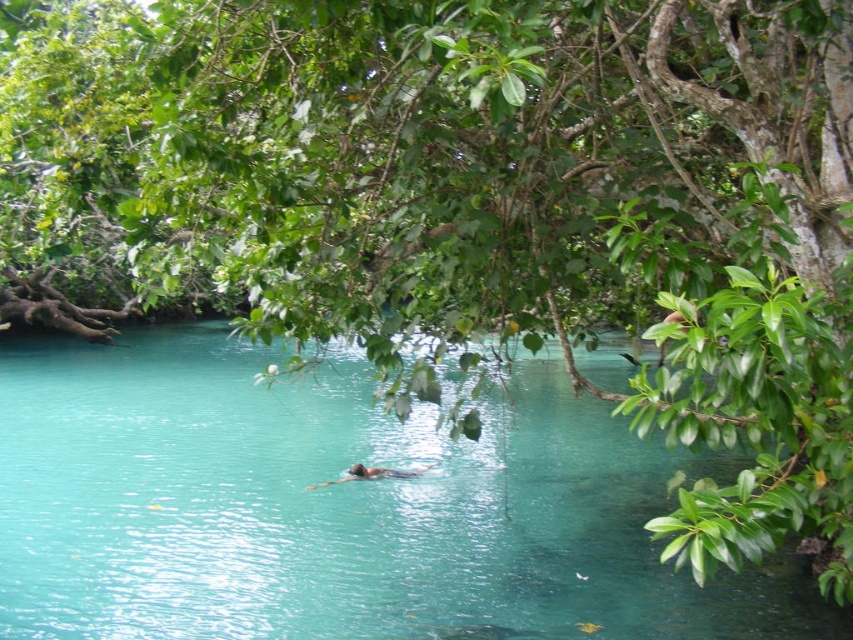
Question: Can you confirm if clear blue water at center is wider than smooth skin person at center?

Choices:
 (A) yes
 (B) no

Answer: (A)

Question: Can you confirm if clear blue water at center is positioned to the left of smooth skin person at center?

Choices:
 (A) yes
 (B) no

Answer: (A)

Question: Can you confirm if clear blue water at center is thinner than smooth skin person at center?

Choices:
 (A) yes
 (B) no

Answer: (B)